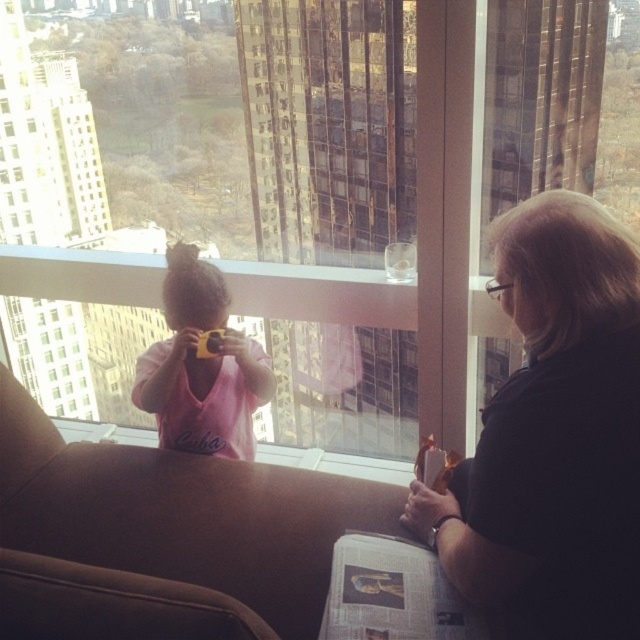
You are a photographer trying to capture a candid shot of both the black matte shirt at right and the pink matte shirt at center. Since you can only focus on one person at a time, which person should you aim your camera at first to ensure both are in the frame?

You should aim your camera at the black matte shirt at right first because it is positioned to the right of the pink matte shirt at center, so starting with the rightmost subject ensures the left subject remains in the frame as you adjust.

You are standing in the living room and want to place a small potted plant between the two points, point (538, 13) and point (260, 376). Which point should the plant be closer to so that it is in front of the other point?

The plant should be closer to point (538, 13) because it is in front of point (260, 376).